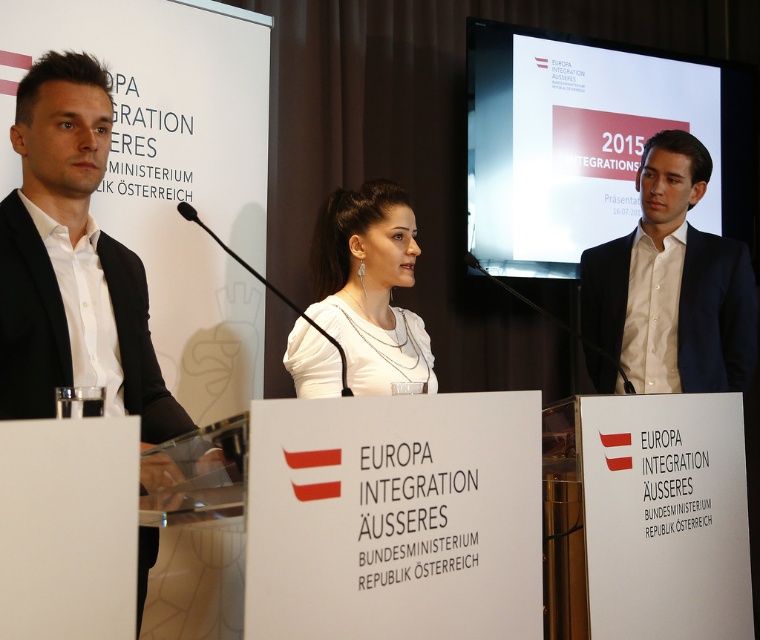
Who is more distant from viewer, (697, 189) or (397, 355)?

Point (697, 189)

You are a GUI agent. You are given a task and a screenshot of the screen. Output one action in this format:
    pyautogui.click(x=<x>, y=<y>)
    Task: Click on the white shirt at center
    The image size is (760, 640).
    Given the screenshot: What is the action you would take?
    pyautogui.click(x=670, y=288)